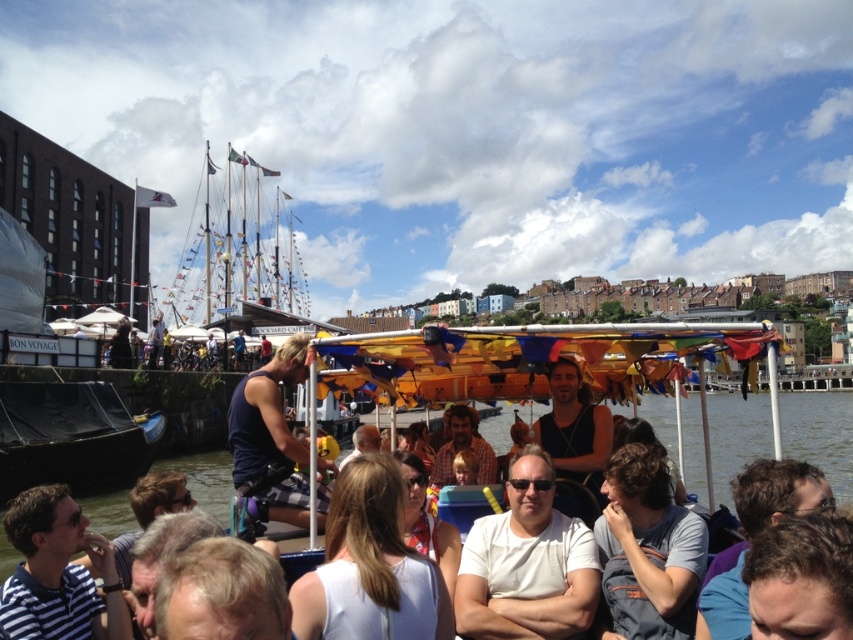
Question: Can you confirm if dark brown hair at lower right is positioned to the left of dark blue sleeveless shirt at center?

Choices:
 (A) no
 (B) yes

Answer: (A)

Question: Can you confirm if black fabric shirt at center is smaller than plaid fabric shirt at center?

Choices:
 (A) yes
 (B) no

Answer: (B)

Question: Is white fabric dress at center bigger than gray cotton shirt at center?

Choices:
 (A) no
 (B) yes

Answer: (B)

Question: Which object is positioned closest to the white fabric sunglasses at center?

Choices:
 (A) striped fabric shirt at lower left
 (B) plaid fabric shirt at center
 (C) transparent plastic boat at center

Answer: (B)

Question: Which point is farther to the camera?

Choices:
 (A) (817, 484)
 (B) (265, 388)
 (C) (784, 621)

Answer: (B)

Question: Which is nearer to the gray cotton shirt at center?

Choices:
 (A) transparent plastic boat at center
 (B) dark blue sleeveless shirt at center
 (C) dark brown hair at lower right
 (D) striped fabric shirt at lower left

Answer: (C)